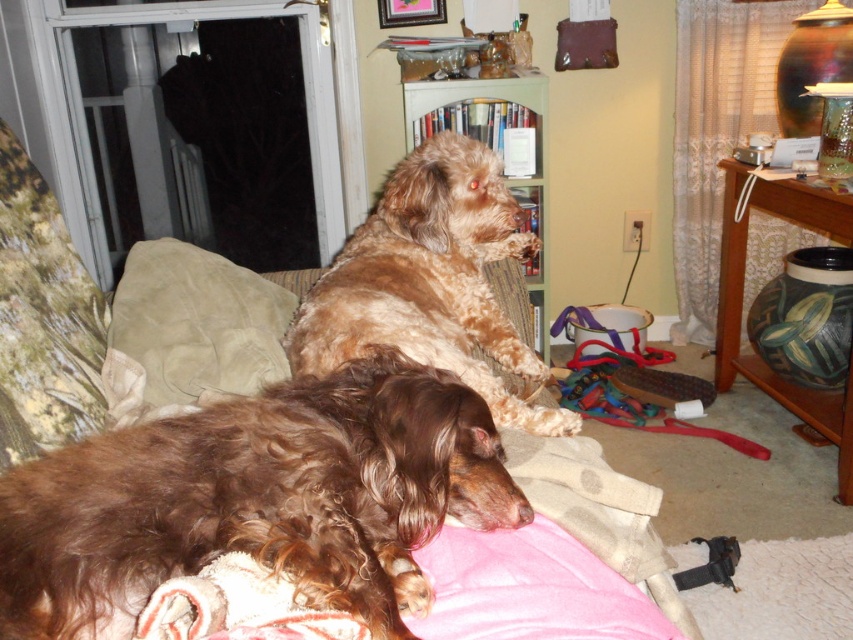
Does brown shaggy dog at lower left have a greater height compared to brown furry dog at upper center?

No.

Describe the element at coordinates (259, 497) in the screenshot. The height and width of the screenshot is (640, 853). I see `brown shaggy dog at lower left` at that location.

Is point (100, 586) positioned after point (512, 413)?

No, it is in front of (512, 413).

Where is `brown shaggy dog at lower left`? The image size is (853, 640). brown shaggy dog at lower left is located at coordinates (259, 497).

Between point (463, 285) and point (242, 339), which one is positioned in front?

Positioned in front is point (242, 339).

Does brown furry dog at upper center have a greater width compared to beige suede pillow at center?

Correct, the width of brown furry dog at upper center exceeds that of beige suede pillow at center.

Is point (350, 278) farther from camera compared to point (140, 388)?

Yes, point (350, 278) is behind point (140, 388).

The image size is (853, 640). What are the coordinates of `brown furry dog at upper center` in the screenshot? It's located at (430, 282).

Can you confirm if suede-like beige couch at center is bigger than beige suede pillow at center?

Yes, suede-like beige couch at center is bigger than beige suede pillow at center.

Does suede-like beige couch at center appear under beige suede pillow at center?

Incorrect, suede-like beige couch at center is not positioned below beige suede pillow at center.

Identify the location of suede-like beige couch at center. click(109, 321).